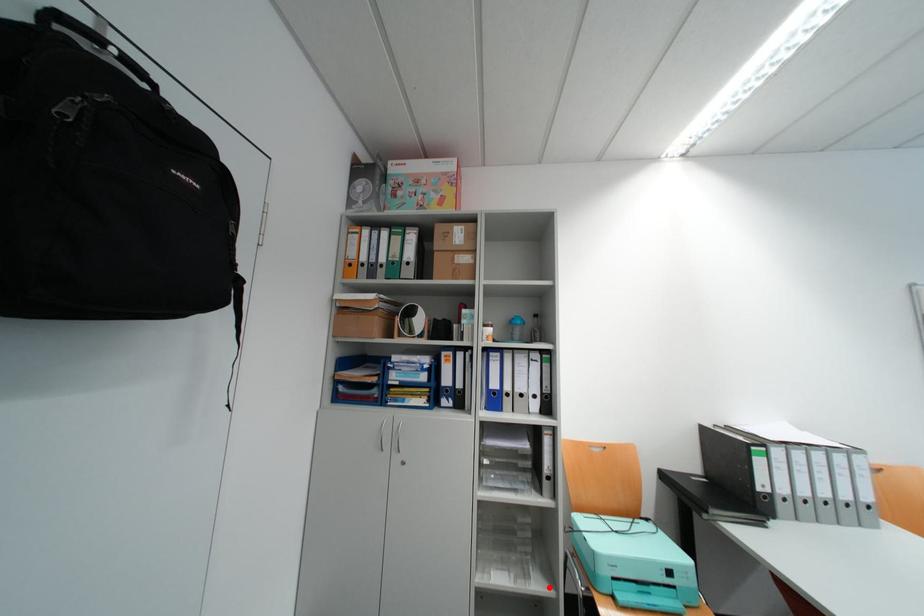
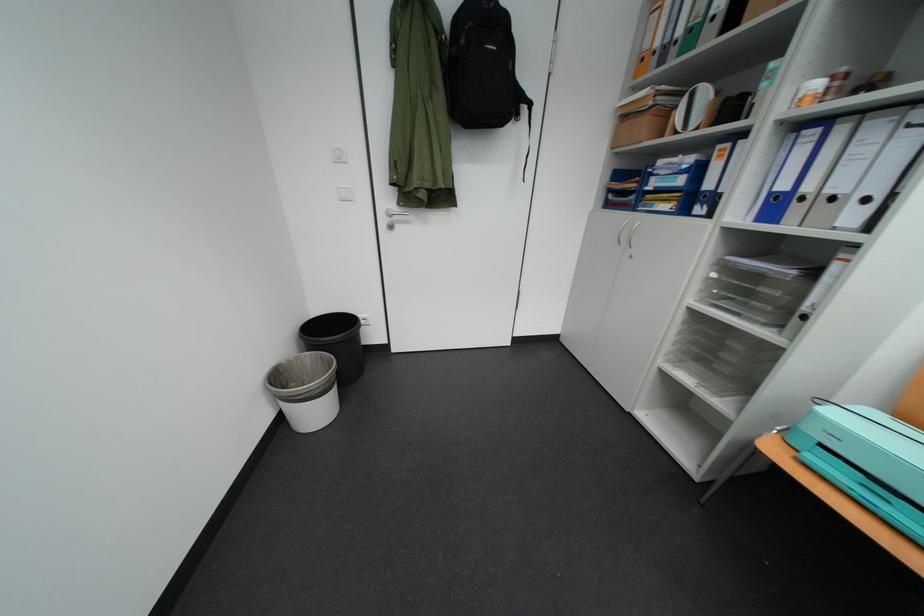
Find the pixel in the second image that matches the highlighted location in the first image.

(730, 403)